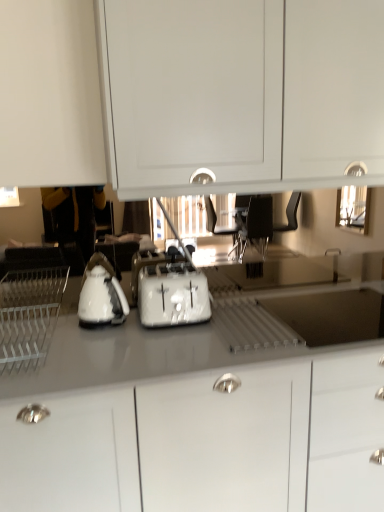
Locate an element on the screen. The width and height of the screenshot is (384, 512). blank area to the left of white glossy electric kettle at center is located at coordinates (59, 323).